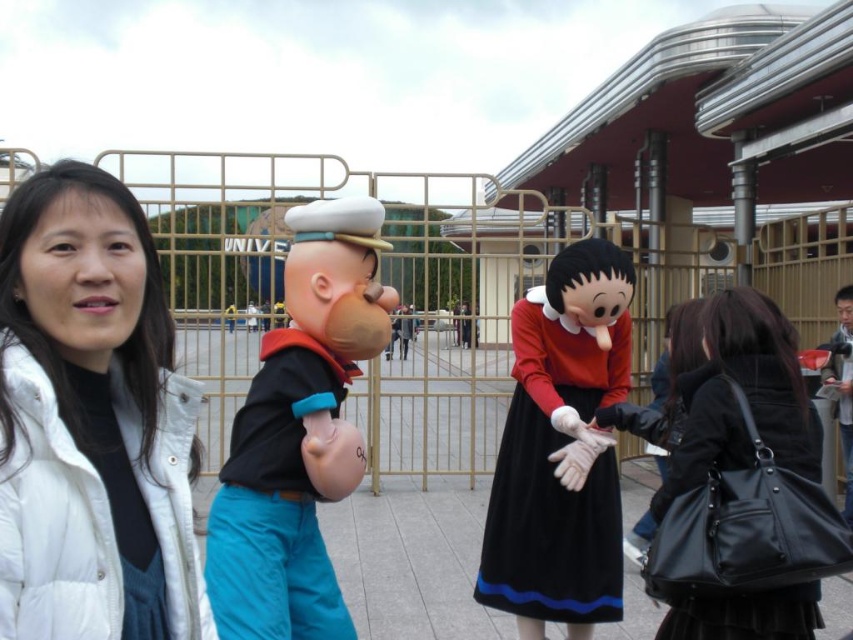
You are a photographer standing on the walkway at the amusement park. You want to take a photo of both the white down jacket at left and the velvet black dress at center. Which piece of clothing should you focus on first if you want to capture them from left to right in the frame?

You should focus on the white down jacket at left first since it is positioned on the left side of the velvet black dress at center, aligning with the left to right order.

You are a photographer trying to capture a group photo of visitors at the amusement park. You notice a person wearing a white down jacket at left and another wearing a velvet black dress at center. Since you want to ensure both are visible in the frame, which clothing item should you focus on to ensure the entire width of both is captured?

You should focus on the velvet black dress at center because its width is greater than the white down jacket at left, so ensuring it fits will accommodate both in the frame.